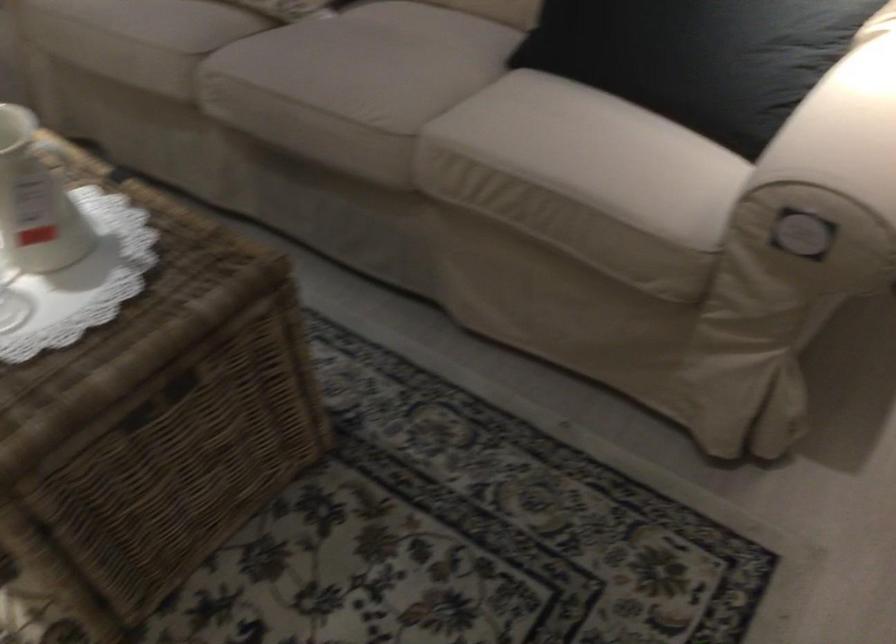
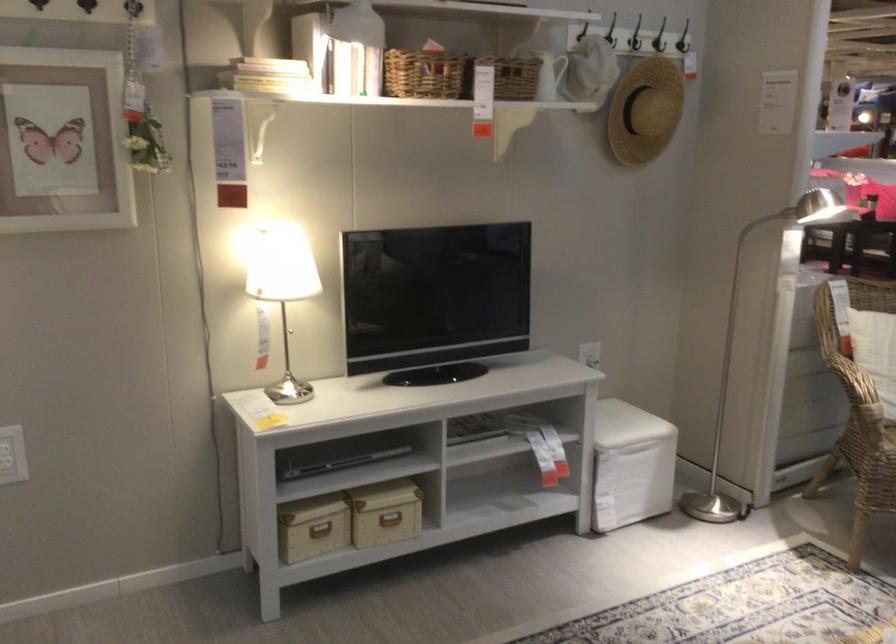
Based on the continuous images, in which direction is the camera rotating?

The rotation direction of the camera is left-down.